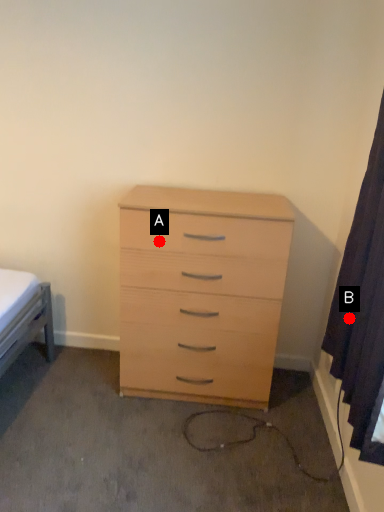
Question: Two points are circled on the image, labeled by A and B beside each circle. Which of the following is the closest to the observer?

Choices:
 (A) A is closer
 (B) B is closer

Answer: (B)